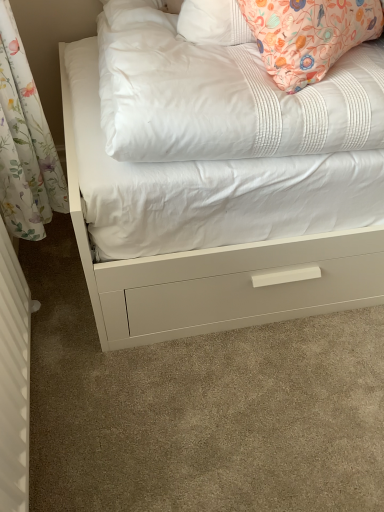
Question: Would you say white quilted mattress at upper center is a long distance from white textured radiator at left?

Choices:
 (A) yes
 (B) no

Answer: (B)

Question: Considering the relative sizes of white quilted mattress at upper center and white textured radiator at left in the image provided, is white quilted mattress at upper center bigger than white textured radiator at left?

Choices:
 (A) yes
 (B) no

Answer: (A)

Question: Is white quilted mattress at upper center shorter than white textured radiator at left?

Choices:
 (A) yes
 (B) no

Answer: (A)

Question: Is white quilted mattress at upper center turned away from white textured radiator at left?

Choices:
 (A) yes
 (B) no

Answer: (B)

Question: Does white quilted mattress at upper center turn towards white textured radiator at left?

Choices:
 (A) yes
 (B) no

Answer: (B)

Question: From a real-world perspective, is white quilted mattress at upper center on white textured radiator at left?

Choices:
 (A) no
 (B) yes

Answer: (B)

Question: Is white textured radiator at left further to the viewer compared to white quilted mattress at upper center?

Choices:
 (A) no
 (B) yes

Answer: (A)

Question: Is white quilted mattress at upper center inside white textured radiator at left?

Choices:
 (A) no
 (B) yes

Answer: (A)

Question: From the image's perspective, is white textured radiator at left on white quilted mattress at upper center?

Choices:
 (A) no
 (B) yes

Answer: (A)

Question: Is white textured radiator at left turned away from white quilted mattress at upper center?

Choices:
 (A) no
 (B) yes

Answer: (A)

Question: Can you confirm if white textured radiator at left is smaller than white quilted mattress at upper center?

Choices:
 (A) yes
 (B) no

Answer: (A)

Question: Is white textured radiator at left not near white quilted mattress at upper center?

Choices:
 (A) no
 (B) yes

Answer: (A)

Question: Looking at their shapes, would you say white quilted mattress at upper center is wider or thinner than white textured radiator at left?

Choices:
 (A) wide
 (B) thin

Answer: (A)